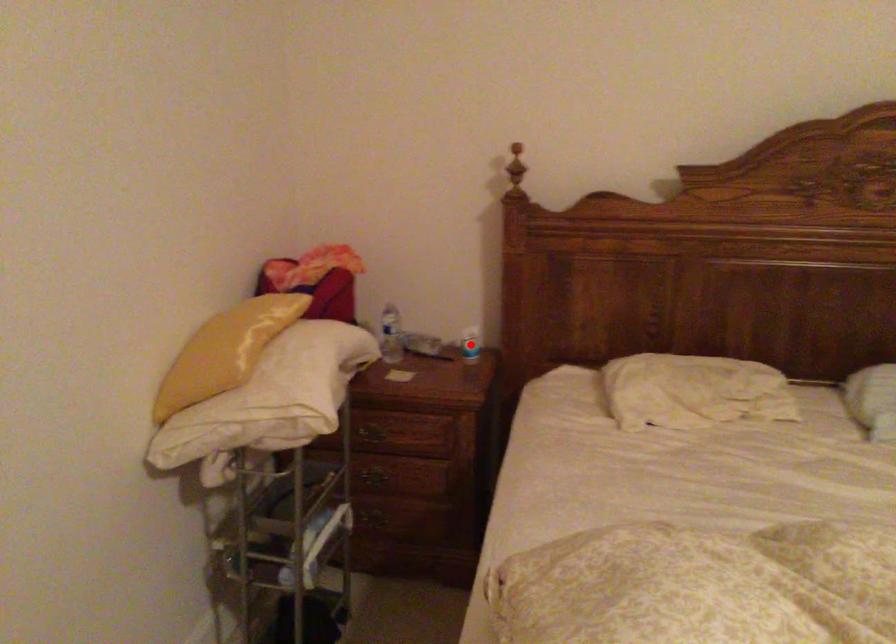
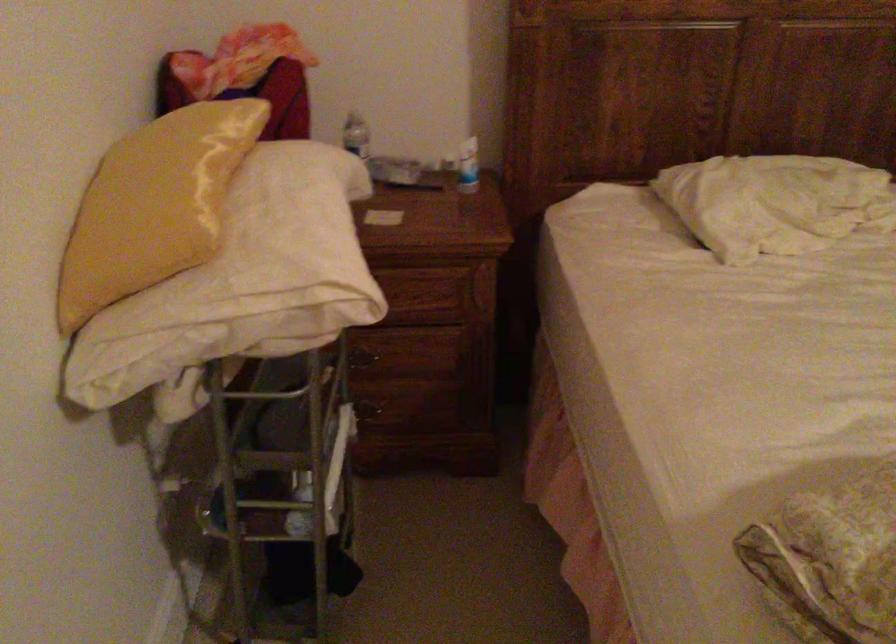
In the second image, find the point that corresponds to the highlighted location in the first image.

(468, 166)